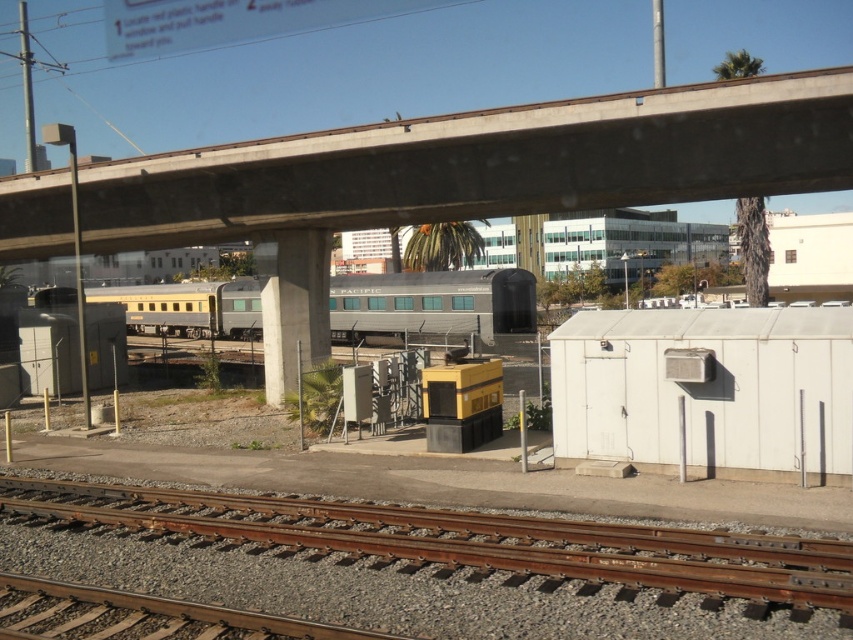
Consider the image. You are standing on the railway tracks and see the concrete at upper center and the metallic gray train car at center. Which object is closer to you?

The metallic gray train car at center is closer to you because it is only 30.93 feet away from the concrete at upper center, so the train car is nearer than the concrete.

You are a railway inspector checking the tracks. You notice the brown wooden track at lower center and the metallic gray train car at center. Which one has a greater width?

The metallic gray train car at center has a greater width than the brown wooden track at lower center.

Please provide the coordinates of the brown wooden track at lower center in the image. The coordinate system is normalized, with the origin at the bottom left corner of the image, and the x and y axes increasing to the right and up respectively. The coordinates should be given as a tuple of two decimal numbers rounded to three decimal places.

The coordinates of the brown wooden track at lower center are at point (469, 541).